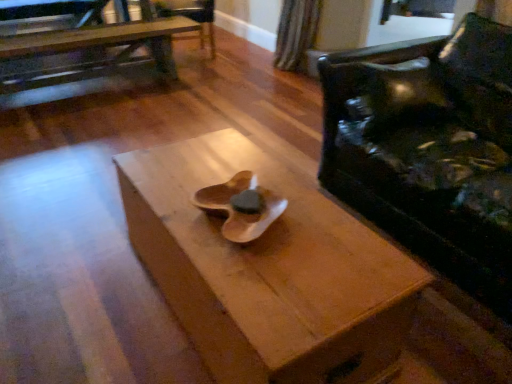
Question: Is wooden armchair at upper center bigger than black leather couch at right?

Choices:
 (A) no
 (B) yes

Answer: (A)

Question: Is wooden armchair at upper center facing away from black leather couch at right?

Choices:
 (A) yes
 (B) no

Answer: (B)

Question: Can you confirm if wooden armchair at upper center is positioned to the left of black leather couch at right?

Choices:
 (A) no
 (B) yes

Answer: (B)

Question: From the image's perspective, is wooden armchair at upper center located beneath black leather couch at right?

Choices:
 (A) no
 (B) yes

Answer: (A)

Question: From the image's perspective, is wooden armchair at upper center on black leather couch at right?

Choices:
 (A) no
 (B) yes

Answer: (B)

Question: Are wooden armchair at upper center and black leather couch at right located far from each other?

Choices:
 (A) yes
 (B) no

Answer: (A)

Question: From a real-world perspective, is wooden table at upper left, the 2th table viewed from the right, beneath black leather couch at right?

Choices:
 (A) yes
 (B) no

Answer: (A)

Question: Is wooden table at upper left, placed as the first table when sorted from left to right, turned away from black leather couch at right?

Choices:
 (A) yes
 (B) no

Answer: (A)

Question: Is wooden table at upper left, placed as the first table when sorted from left to right, further to the viewer compared to black leather couch at right?

Choices:
 (A) yes
 (B) no

Answer: (A)

Question: Considering the relative sizes of wooden table at upper left, placed as the second table when sorted from front to back, and black leather couch at right in the image provided, is wooden table at upper left, placed as the second table when sorted from front to back, taller than black leather couch at right?

Choices:
 (A) yes
 (B) no

Answer: (B)

Question: Is wooden table at upper left, arranged as the 1th table when viewed from the back, positioned before black leather couch at right?

Choices:
 (A) no
 (B) yes

Answer: (A)

Question: From the image's perspective, is wooden table at upper left, the 2th table viewed from the right, below black leather couch at right?

Choices:
 (A) no
 (B) yes

Answer: (A)

Question: Does wooden table at upper left, arranged as the 1th table when viewed from the back, have a greater height compared to wooden armchair at upper center?

Choices:
 (A) no
 (B) yes

Answer: (A)